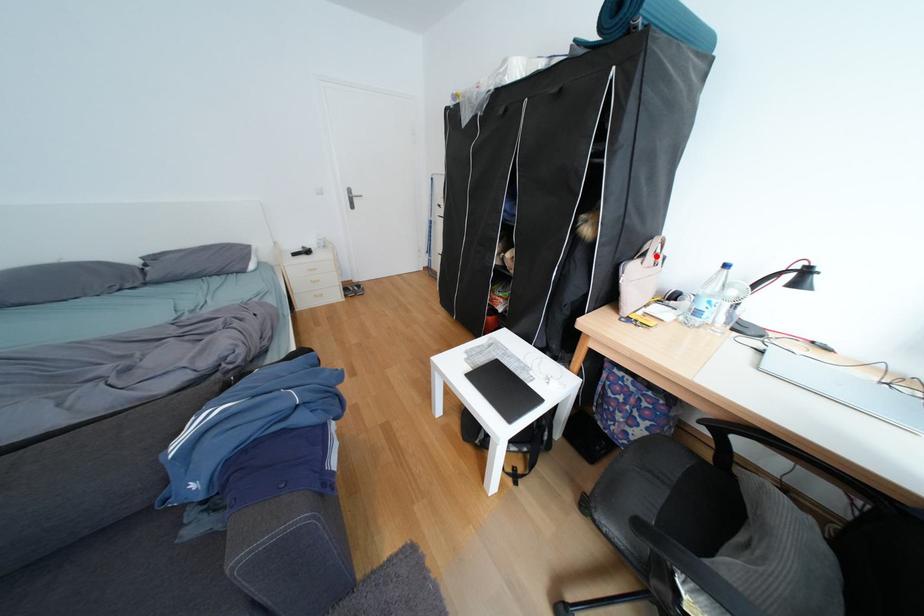
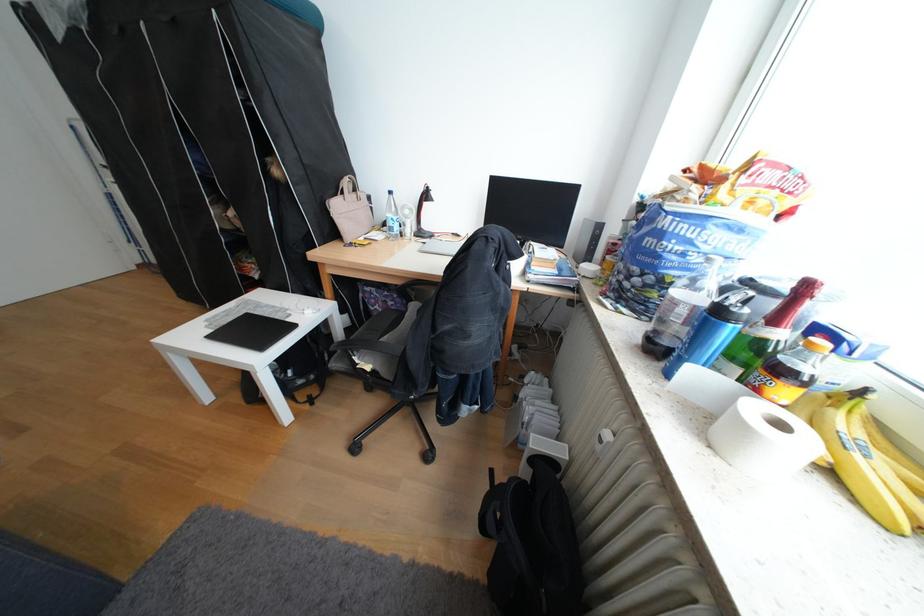
In the second image, find the point that corresponds to the highlighted location in the first image.

(355, 193)